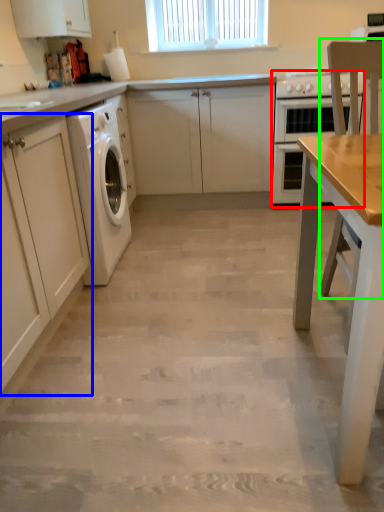
Question: Which object is the closest to the home appliance (highlighted by a red box)? Choose among these: cabinetry (highlighted by a blue box) or chair (highlighted by a green box).

Choices:
 (A) cabinetry
 (B) chair

Answer: (B)